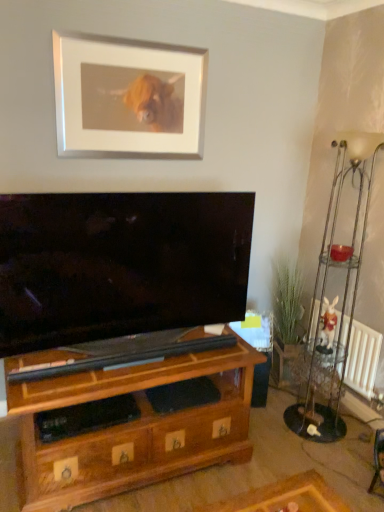
Question: Is metallic silver floor lamp at right wider or thinner than white matte picture frame at upper center?

Choices:
 (A) wide
 (B) thin

Answer: (A)

Question: Based on their sizes in the image, would you say metallic silver floor lamp at right is bigger or smaller than white matte picture frame at upper center?

Choices:
 (A) small
 (B) big

Answer: (B)

Question: Which object is the farthest from the white radiator at lower right?

Choices:
 (A) metallic silver floor lamp at right
 (B) white plush rabbit at right
 (C) white matte picture frame at upper center
 (D) brown wood shelf at lower left
 (E) metallic silver side table at right

Answer: (C)

Question: Which is farther from the metallic silver floor lamp at right?

Choices:
 (A) white radiator at lower right
 (B) white matte picture frame at upper center
 (C) metallic silver side table at right
 (D) white plush rabbit at right
 (E) brown wood shelf at lower left

Answer: (B)